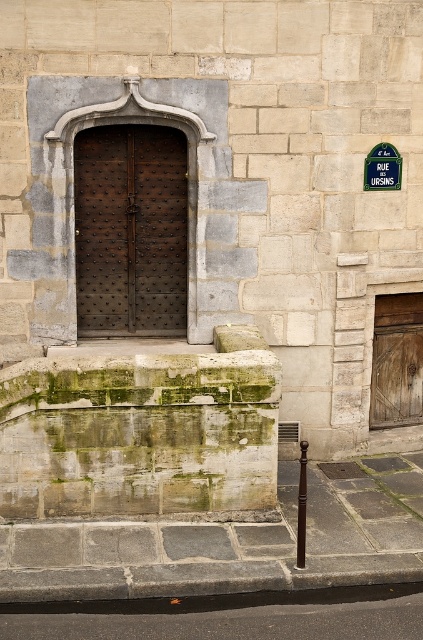
You are standing in front of the stone building and want to read the green plastic sign at upper right. Is the dark brown wooden door at center blocking your view of the sign?

The dark brown wooden door at center is closer to the viewer than green plastic sign at upper right, so the door may block your view of the sign depending on your position.

You are a delivery person trying to locate the entrance to the building. You see the dark brown wooden door at center and the green plastic sign at upper right. Which object is larger in size?

The dark brown wooden door at center is bigger than the green plastic sign at upper right according to the description.